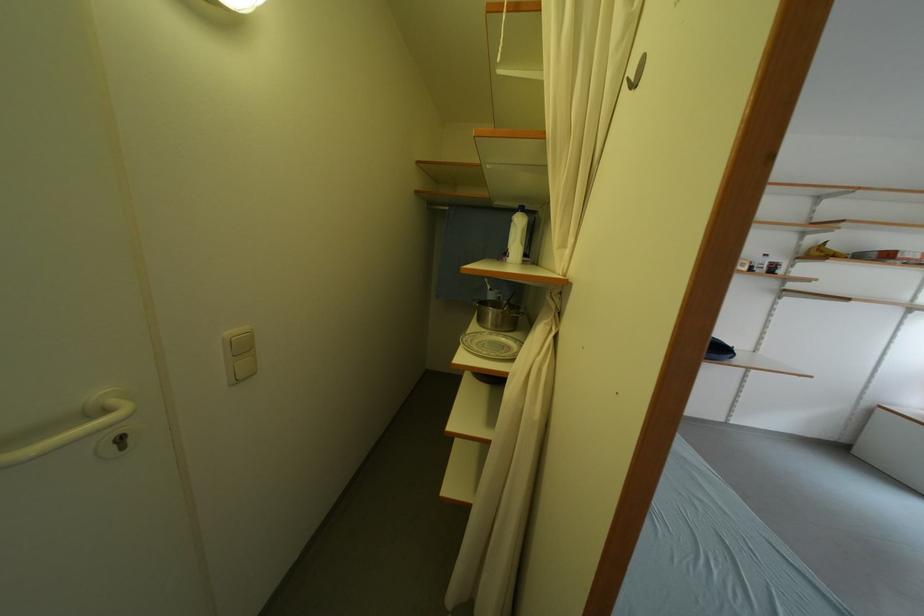
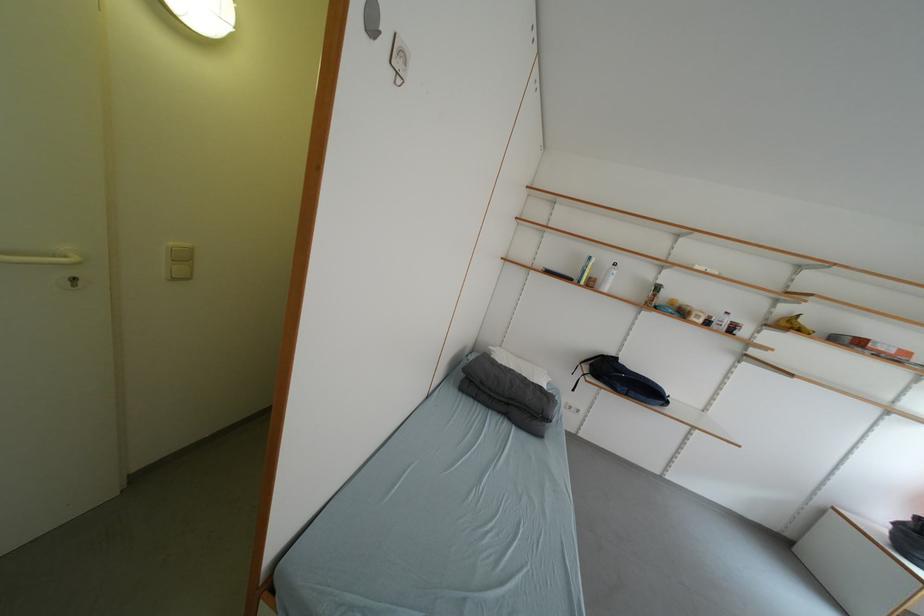
In the second image, find the point that corresponds to (x=251, y=351) in the first image.

(191, 261)